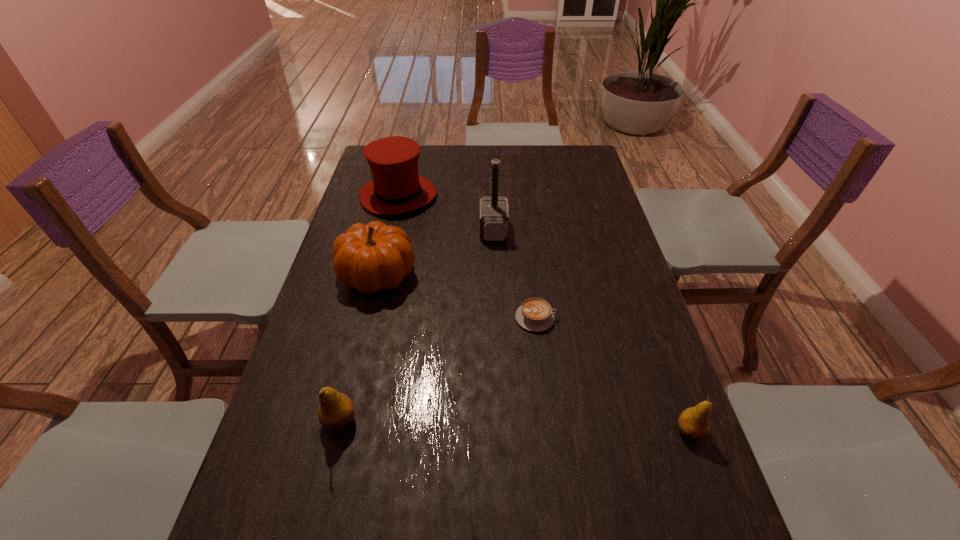
Find the location of `pumpkin located in the left edge section of the desktop`. pumpkin located in the left edge section of the desktop is located at coordinates 372,257.

Image resolution: width=960 pixels, height=540 pixels. What are the coordinates of `object that is at the right edge` in the screenshot? It's located at (693, 422).

You are a GUI agent. You are given a task and a screenshot of the screen. Output one action in this format:
    pyautogui.click(x=<x>, y=<y>)
    Task: Click on the object present at the far left corner
    This screenshot has width=960, height=540.
    Given the screenshot: What is the action you would take?
    pyautogui.click(x=396, y=188)

I want to click on vacant space at the far edge of the desktop, so click(x=543, y=157).

What are the coordinates of `free region at the near edge of the desktop` in the screenshot? It's located at (433, 499).

Where is `free space at the left edge`? free space at the left edge is located at coordinates (349, 293).

Find the location of a particular element. This screenshot has width=960, height=540. free spot at the right edge of the desktop is located at coordinates (596, 199).

The image size is (960, 540). In the image, there is a desktop. Find the location of `blank space at the near right corner`. blank space at the near right corner is located at coordinates (640, 499).

Find the location of a particular element. The image size is (960, 540). unoccupied area between the taller pear and the fourth object from left to right is located at coordinates (417, 326).

Locate an element on the screen. unoccupied area between the rightmost object and the cappuccino is located at coordinates (612, 374).